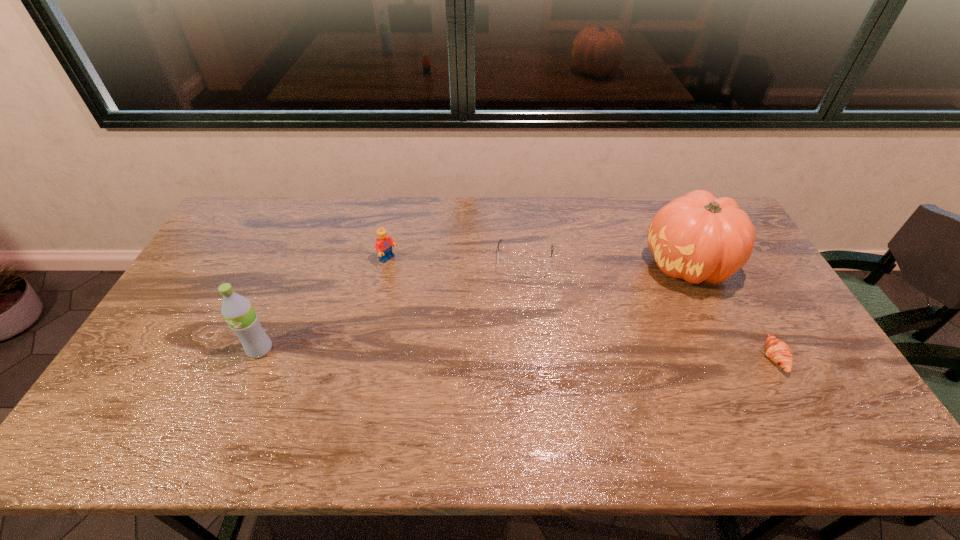
Identify the location of free space between the second shortest object and the pumpkin. (607, 261).

At what (x,y) coordinates should I click in order to perform the action: click on free spot between the third object from left to right and the leftmost object. Please return your answer as a coordinate pair (x, y). Looking at the image, I should click on (393, 304).

Where is `empty space that is in between the water bottle and the second object from left to right`? Image resolution: width=960 pixels, height=540 pixels. empty space that is in between the water bottle and the second object from left to right is located at coordinates (324, 305).

Locate an element on the screen. This screenshot has width=960, height=540. free area in between the pumpkin and the shortest object is located at coordinates [x=731, y=310].

This screenshot has width=960, height=540. In order to click on free space between the pumpkin and the Lego in this screenshot , I will do `click(539, 262)`.

This screenshot has height=540, width=960. I want to click on free space between the pumpkin and the shortest object, so click(731, 310).

This screenshot has height=540, width=960. What are the coordinates of `empty space that is in between the fourth object from right to left and the pumpkin` in the screenshot? It's located at (539, 262).

Identify the location of vacant point located between the third shortest object and the shortest object. (582, 308).

Locate an element on the screen. This screenshot has width=960, height=540. object that is the second nearest to the third tallest object is located at coordinates pos(237,310).

This screenshot has width=960, height=540. Identify the location of object that stands as the third closest to the shortest object. (384, 242).